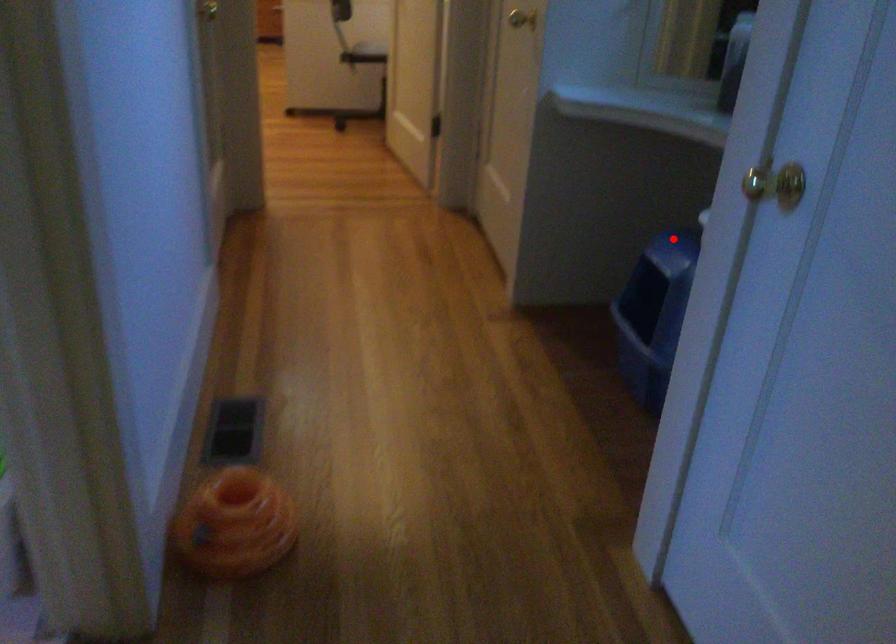
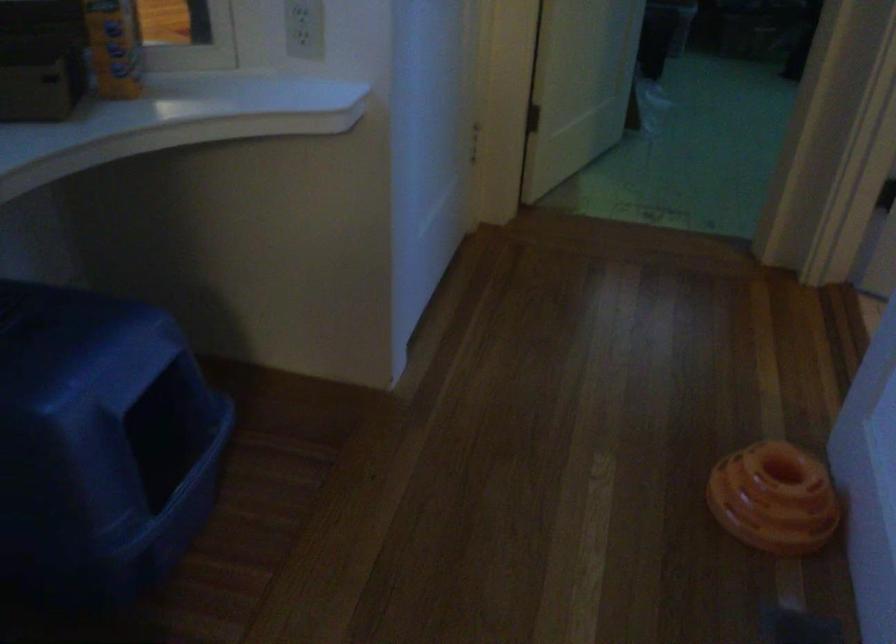
Question: A red point is marked in image1. In image2, is the corresponding 3D point closer to the camera or farther? Reply with the corresponding letter.

Choices:
 (A) The corresponding 3D point is closer.
 (B) The corresponding 3D point is farther.

Answer: (A)